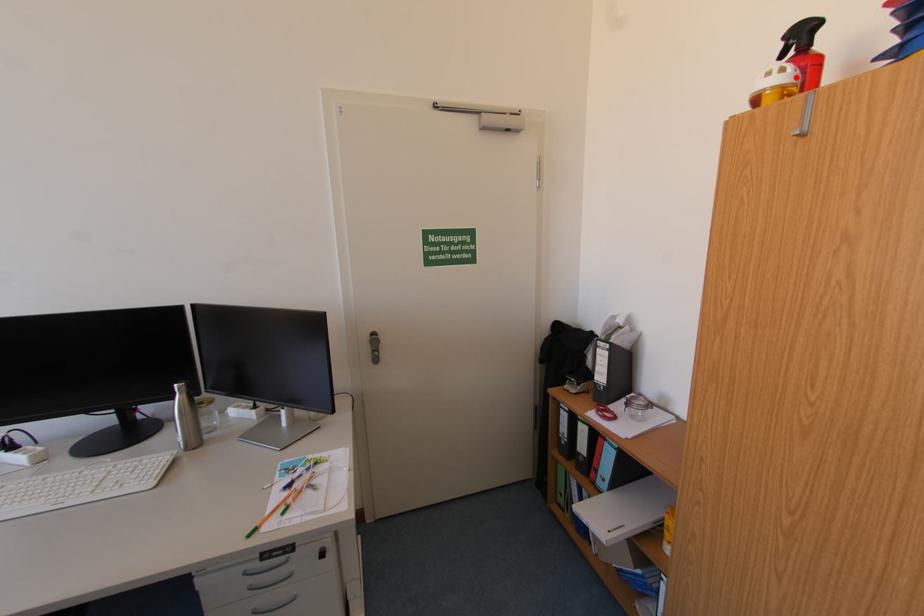
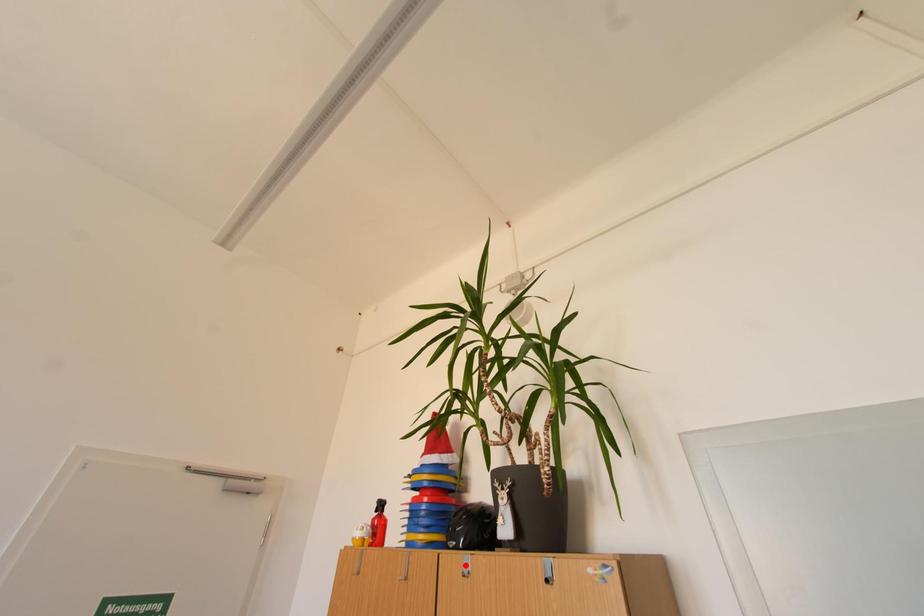
I am providing you with two images of the same scene from different viewpoints. A red point is marked on the first image and another point is marked on the second image. Do the highlighted points in image1 and image2 indicate the same real-world spot?

No